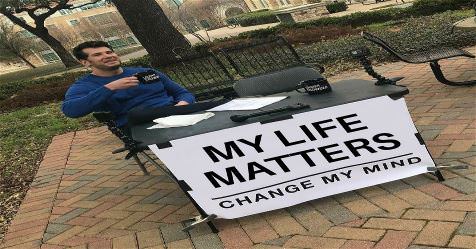
Where is `white poster`? This screenshot has height=249, width=476. white poster is located at coordinates (181, 159).